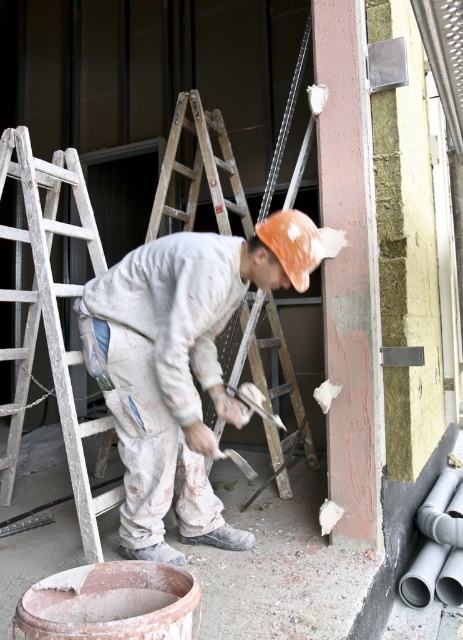
Is white powdery cement at lower center to the right of wooden ladder at center from the viewer's perspective?

Incorrect, white powdery cement at lower center is not on the right side of wooden ladder at center.

Does white powdery cement at lower center appear over wooden ladder at center?

No, white powdery cement at lower center is not above wooden ladder at center.

Locate an element on the screen. Image resolution: width=463 pixels, height=640 pixels. white powdery cement at lower center is located at coordinates (279, 566).

Is point (48, 298) closer to camera compared to point (269, 346)?

Yes, it is in front of point (269, 346).

Is point (70, 168) positioned after point (275, 310)?

No, (70, 168) is closer to viewer.

Between point (67, 429) and point (193, 193), which one is positioned in front?

Positioned in front is point (67, 429).

Find the location of a particular element. This screenshot has height=640, width=463. white wooden ladder at left is located at coordinates (51, 317).

Does white matte paint at center have a lesser width compared to white powdery cement at lower center?

Yes.

Is white matte paint at center smaller than white powdery cement at lower center?

No, white matte paint at center is not smaller than white powdery cement at lower center.

Who is more forward, (232, 531) or (273, 627)?

Positioned in front is point (273, 627).

Where is `white matte paint at center`? This screenshot has width=463, height=640. white matte paint at center is located at coordinates (179, 365).